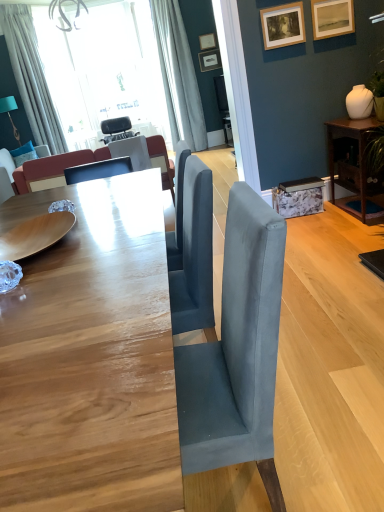
The height and width of the screenshot is (512, 384). I want to click on matte white picture frame at upper center, acting as the third picture frame starting from the front, so click(207, 41).

At what (x,y) coordinates should I click in order to perform the action: click on matte black picture frame at upper center, which is counted as the 1th picture frame, starting from the back. Please return your answer as a coordinate pair (x, y). Looking at the image, I should click on [210, 60].

This screenshot has height=512, width=384. What do you see at coordinates (91, 357) in the screenshot? I see `smooth wooden table at center, arranged as the 2th table when viewed from the top` at bounding box center [91, 357].

Where is `velvet fabric couch at left, which is the 1th couch from left to right`? The image size is (384, 512). velvet fabric couch at left, which is the 1th couch from left to right is located at coordinates (12, 172).

Consider the image. What is the approximate width of velvet fabric couch at left, arranged as the first couch when viewed from the back?

velvet fabric couch at left, arranged as the first couch when viewed from the back, is 31.48 inches wide.

What do you see at coordinates (117, 129) in the screenshot? The image size is (384, 512). I see `matte black chair at upper center, which ranks as the 1th chair in top-to-bottom order` at bounding box center [117, 129].

How much space does matte wooden picture frame at upper right, which is counted as the third picture frame, starting from the top, occupy horizontally?

matte wooden picture frame at upper right, which is counted as the third picture frame, starting from the top, is 1.26 inches in width.

Find the location of a particular element. The height and width of the screenshot is (512, 384). matte wooden picture frame at upper right, which is counted as the third picture frame, starting from the top is located at coordinates (332, 18).

This screenshot has height=512, width=384. Describe the element at coordinates (178, 76) in the screenshot. I see `white fabric curtain at upper center, the first curtain from the right` at that location.

In order to click on matte white picture frame at upper center, placed as the second picture frame when sorted from back to front in this screenshot , I will do `click(207, 41)`.

Does point (20, 169) come behind point (28, 114)?

No, (20, 169) is in front of (28, 114).

Considering the relative positions of velvet fabric couch at left, arranged as the first couch when viewed from the back, and white fabric curtain at upper left, positioned as the 2th curtain in right-to-left order, in the image provided, is velvet fabric couch at left, arranged as the first couch when viewed from the back, behind white fabric curtain at upper left, positioned as the 2th curtain in right-to-left order,?

No.

Based on their positions, is velvet fabric couch at left, the second couch positioned from the front, located to the left or right of white fabric curtain at upper left, arranged as the 1th curtain when viewed from the left?

velvet fabric couch at left, the second couch positioned from the front, is positioned on white fabric curtain at upper left, arranged as the 1th curtain when viewed from the left,'s left side.

How far apart are velvet fabric couch at left, the second couch positioned from the front, and white fabric curtain at upper left, positioned as the 2th curtain in right-to-left order?

velvet fabric couch at left, the second couch positioned from the front, and white fabric curtain at upper left, positioned as the 2th curtain in right-to-left order, are 39.18 inches apart from each other.

Find the location of a particular element. Image resolution: width=384 pixels, height=512 pixels. table that is the 2nd one when counting forward from the velvet red couch at center, acting as the 1th couch starting from the front is located at coordinates (91, 357).

Which is more to the right, smooth wooden table at center, the first table in the bottom-to-top sequence, or velvet red couch at center, acting as the 1th couch starting from the front?

smooth wooden table at center, the first table in the bottom-to-top sequence, is more to the right.

Could you tell me if smooth wooden table at center, marked as the second table in a right-to-left arrangement, is turned towards velvet red couch at center, marked as the 2th couch in a back-to-front arrangement?

No, smooth wooden table at center, marked as the second table in a right-to-left arrangement, is not aimed at velvet red couch at center, marked as the 2th couch in a back-to-front arrangement.

Looking at this image, from a real-world perspective, which is physically above, velvet red couch at center, arranged as the first couch when viewed from the right, or white fabric curtain at upper center, which ranks as the 2th curtain in left-to-right order?

white fabric curtain at upper center, which ranks as the 2th curtain in left-to-right order, is physically above.

Is velvet red couch at center, marked as the second couch in a left-to-right arrangement, located outside white fabric curtain at upper center, which ranks as the 2th curtain in left-to-right order?

Yes, velvet red couch at center, marked as the second couch in a left-to-right arrangement, is outside of white fabric curtain at upper center, which ranks as the 2th curtain in left-to-right order.

Is velvet red couch at center, marked as the second couch in a left-to-right arrangement, facing away from white fabric curtain at upper center, the first curtain from the right?

No, velvet red couch at center, marked as the second couch in a left-to-right arrangement, is not facing the opposite direction of white fabric curtain at upper center, the first curtain from the right.

Between matte black picture frame at upper center, which is counted as the 1th picture frame, starting from the back, and white fabric curtain at upper left, positioned as the 2th curtain in right-to-left order, which one has larger width?

Wider between the two is white fabric curtain at upper left, positioned as the 2th curtain in right-to-left order.

In the scene shown: Which of these two, matte black picture frame at upper center, which is counted as the 1th picture frame, starting from the back, or white fabric curtain at upper left, positioned as the 2th curtain in right-to-left order, is bigger?

white fabric curtain at upper left, positioned as the 2th curtain in right-to-left order.

Is matte black picture frame at upper center, which is the fourth picture frame from front to back, beside white fabric curtain at upper left, arranged as the 1th curtain when viewed from the left?

No.

Based on their positions, is matte black picture frame at upper center, which is the fourth picture frame from front to back, located to the left or right of white fabric curtain at upper left, arranged as the 1th curtain when viewed from the left?

From the image, it's evident that matte black picture frame at upper center, which is the fourth picture frame from front to back, is to the right of white fabric curtain at upper left, arranged as the 1th curtain when viewed from the left.

Who is more distant, matte white picture frame at upper center, placed as the second picture frame when sorted from back to front, or brown wood table at right, arranged as the second table when ordered from the bottom?

Positioned behind is matte white picture frame at upper center, placed as the second picture frame when sorted from back to front.

Consider the image. Which is closer to the camera, [200,44] or [361,182]?

The point [361,182] is in front.

From the image's perspective, which one is positioned higher, matte white picture frame at upper center, acting as the first picture frame starting from the top, or brown wood table at right, which is the second table from front to back?

matte white picture frame at upper center, acting as the first picture frame starting from the top, is shown above in the image.

There is a brown wood table at right, acting as the 1th table starting from the back. At what (x,y) coordinates should I click in order to perform the action: click on the 4th picture frame above it (from the image's perspective). Please return your answer as a coordinate pair (x, y). Image resolution: width=384 pixels, height=512 pixels. Looking at the image, I should click on (207, 41).

Locate an element on the screen. The height and width of the screenshot is (512, 384). curtain that is the 1st object located above the velvet fabric couch at left, the second couch positioned from the front (from the image's perspective) is located at coordinates (31, 77).

Considering the sizes of white fabric curtain at upper left, positioned as the 2th curtain in right-to-left order, and velvet fabric couch at left, marked as the 2th couch in a right-to-left arrangement, in the image, is white fabric curtain at upper left, positioned as the 2th curtain in right-to-left order, wider or thinner than velvet fabric couch at left, marked as the 2th couch in a right-to-left arrangement,?

Clearly, white fabric curtain at upper left, positioned as the 2th curtain in right-to-left order, has less width compared to velvet fabric couch at left, marked as the 2th couch in a right-to-left arrangement.

Is point (14, 71) closer to camera compared to point (46, 152)?

Yes, it is in front of point (46, 152).

Is white fabric curtain at upper left, positioned as the 2th curtain in right-to-left order, positioned behind velvet fabric couch at left, arranged as the first couch when viewed from the back?

That is True.

Can you confirm if white fabric curtain at upper left, arranged as the 1th curtain when viewed from the left, is positioned to the left of brown wood table at right, acting as the 1th table starting from the back?

Yes, white fabric curtain at upper left, arranged as the 1th curtain when viewed from the left, is to the left of brown wood table at right, acting as the 1th table starting from the back.

Considering the relative sizes of white fabric curtain at upper left, arranged as the 1th curtain when viewed from the left, and brown wood table at right, which ranks as the 1th table in top-to-bottom order, in the image provided, is white fabric curtain at upper left, arranged as the 1th curtain when viewed from the left, shorter than brown wood table at right, which ranks as the 1th table in top-to-bottom order,?

Incorrect, the height of white fabric curtain at upper left, arranged as the 1th curtain when viewed from the left, does not fall short of that of brown wood table at right, which ranks as the 1th table in top-to-bottom order.

Is white fabric curtain at upper left, arranged as the 1th curtain when viewed from the left, far from brown wood table at right, the 2th table when ordered from left to right?

Yes.

Does point (48, 111) appear closer or farther from the camera than point (342, 128)?

Point (48, 111) is positioned farther from the camera compared to point (342, 128).

Find the location of a particular element. This screenshot has height=512, width=384. the 1st curtain above the velvet fabric couch at left, which is the 1th couch from left to right (from the image's perspective) is located at coordinates (31, 77).

Locate an element on the screen. The image size is (384, 512). the 2nd table in front of the velvet red couch at center, marked as the second couch in a left-to-right arrangement, counting from the anchor's position is located at coordinates (91, 357).

Looking at the image, which one is located further to white fabric curtain at upper left, arranged as the 1th curtain when viewed from the left, smooth wooden table at center, placed as the 2th table when sorted from back to front, or matte white picture frame at upper center, acting as the first picture frame starting from the top?

The object further to white fabric curtain at upper left, arranged as the 1th curtain when viewed from the left, is smooth wooden table at center, placed as the 2th table when sorted from back to front.

Looking at the image, which one is located closer to matte white picture frame at upper center, acting as the first picture frame starting from the top, wooden picture frame at upper center, the 4th picture frame from the back, or smooth wooden table at center, the first table in the bottom-to-top sequence?

Based on the image, wooden picture frame at upper center, the 4th picture frame from the back, appears to be nearer to matte white picture frame at upper center, acting as the first picture frame starting from the top.

Which object lies further to the anchor point matte black picture frame at upper center, the 3th picture frame in the bottom-to-top sequence, velvet red couch at center, marked as the second couch in a left-to-right arrangement, or velvet fabric couch at left, marked as the 2th couch in a right-to-left arrangement?

Among the two, velvet fabric couch at left, marked as the 2th couch in a right-to-left arrangement, is located further to matte black picture frame at upper center, the 3th picture frame in the bottom-to-top sequence.

Looking at the image, which one is located closer to velvet red couch at center, arranged as the first couch when viewed from the right, matte black picture frame at upper center, which is the fourth picture frame from front to back, or white fabric curtain at upper center, the first curtain from the right?

Based on the image, white fabric curtain at upper center, the first curtain from the right, appears to be nearer to velvet red couch at center, arranged as the first couch when viewed from the right.

Which object lies nearer to the anchor point brown wood table at right, arranged as the second table when ordered from the bottom, matte wooden picture frame at upper right, which is counted as the 2th picture frame, starting from the front, or matte black picture frame at upper center, which ranks as the 2th picture frame in top-to-bottom order?

matte wooden picture frame at upper right, which is counted as the 2th picture frame, starting from the front, is closer to brown wood table at right, arranged as the second table when ordered from the bottom.

Considering their positions, is brown wood table at right, acting as the 1th table starting from the back, positioned further to white fabric curtain at upper left, positioned as the 2th curtain in right-to-left order, than matte black chair at upper center, the 2th chair when ordered from front to back?

Among the two, brown wood table at right, acting as the 1th table starting from the back, is located further to white fabric curtain at upper left, positioned as the 2th curtain in right-to-left order.

Estimate the real-world distances between objects in this image. Which object is closer to velvet fabric couch at left, arranged as the first couch when viewed from the back, wooden picture frame at upper center, the 4th picture frame from the back, or white fabric curtain at upper left, arranged as the 1th curtain when viewed from the left?

white fabric curtain at upper left, arranged as the 1th curtain when viewed from the left, is positioned closer to the anchor velvet fabric couch at left, arranged as the first couch when viewed from the back.

Estimate the real-world distances between objects in this image. Which object is further from smooth wooden table at center, which ranks as the 1th table in front-to-back order, white fabric curtain at upper center, the first curtain from the right, or velvet red couch at center, marked as the 2th couch in a back-to-front arrangement?

Based on the image, white fabric curtain at upper center, the first curtain from the right, appears to be further to smooth wooden table at center, which ranks as the 1th table in front-to-back order.

This screenshot has height=512, width=384. I want to click on chair located between smooth wooden table at center, marked as the second table in a right-to-left arrangement, and matte black picture frame at upper center, which is counted as the 1th picture frame, starting from the back, in the depth direction, so click(x=132, y=151).

I want to click on chair between wooden picture frame at upper center, marked as the first picture frame in a front-to-back arrangement, and matte black picture frame at upper center, which is the fourth picture frame from front to back, along the z-axis, so click(x=132, y=151).

I want to click on chair between wooden picture frame at upper center, positioned as the 1th picture frame in bottom-to-top order, and matte white picture frame at upper center, marked as the fourth picture frame in a bottom-to-top arrangement, along the z-axis, so click(x=132, y=151).

Where is `curtain situated between matte black chair at upper center, which appears as the first chair when viewed from the left, and matte white picture frame at upper center, acting as the third picture frame starting from the front, from left to right`? This screenshot has height=512, width=384. curtain situated between matte black chair at upper center, which appears as the first chair when viewed from the left, and matte white picture frame at upper center, acting as the third picture frame starting from the front, from left to right is located at coordinates (178, 76).